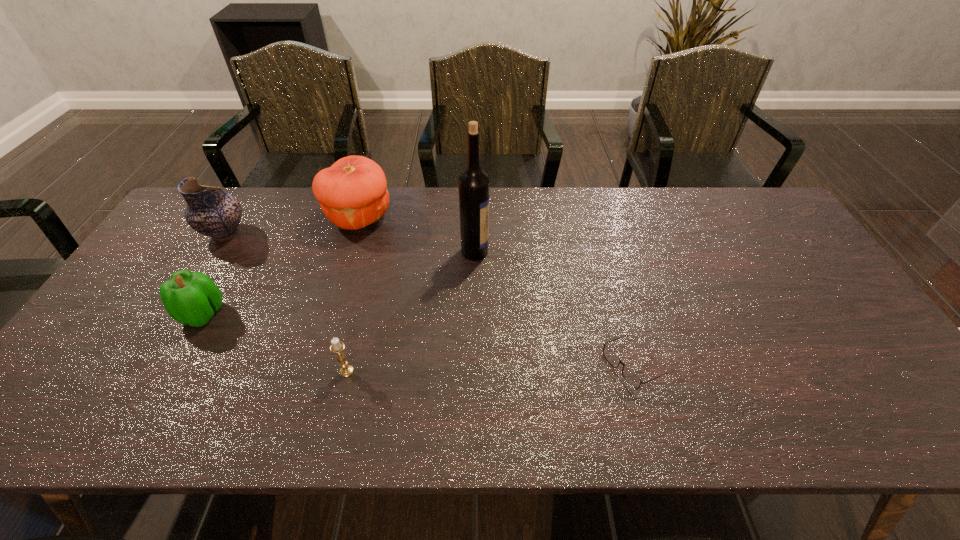
Where is `vacant space that's between the candle holder and the rightmost object`? vacant space that's between the candle holder and the rightmost object is located at coordinates (490, 368).

Find the location of a particular element. The image size is (960, 540). empty location between the bell pepper and the shortest object is located at coordinates (418, 340).

At what (x,y) coordinates should I click in order to perform the action: click on unoccupied position between the shortest object and the pottery. Please return your answer as a coordinate pair (x, y). Looking at the image, I should click on (428, 300).

This screenshot has height=540, width=960. I want to click on vacant area between the bell pepper and the spectacles, so click(418, 340).

Select which object appears as the third closest to the pumpkin. Please provide its 2D coordinates. Your answer should be formatted as a tuple, i.e. [(x, y)], where the tuple contains the x and y coordinates of a point satisfying the conditions above.

[(191, 298)]

Image resolution: width=960 pixels, height=540 pixels. In order to click on object that is the fourth closest to the wine bottle in this screenshot , I will do `click(191, 298)`.

The width and height of the screenshot is (960, 540). What are the coordinates of `free region that satisfies the following two spatial constraints: 1. on the label of the tallest object; 2. on the front side of the candle holder` in the screenshot? It's located at (473, 371).

I want to click on vacant region that satisfies the following two spatial constraints: 1. on the label of the tallest object; 2. on the front side of the candle holder, so click(x=473, y=371).